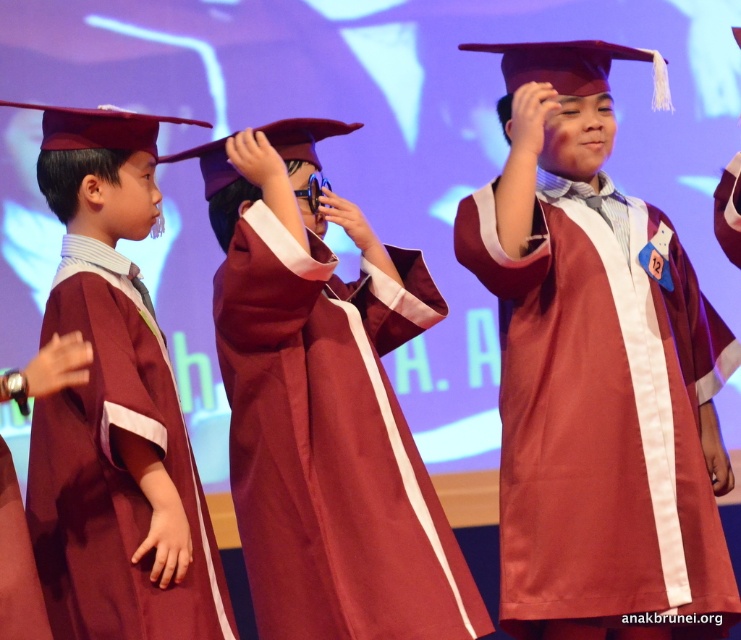
You are a photographer standing in front of the stage where the children are lined up. You need to take a photo of both the maroon satin graduation gown at center and the maroon satin graduation gown at left. Which gown will appear closer to you in the photo?

A: The maroon satin graduation gown at center will appear closer to you in the photo because it is positioned further to the viewer compared to the maroon satin graduation gown at left.